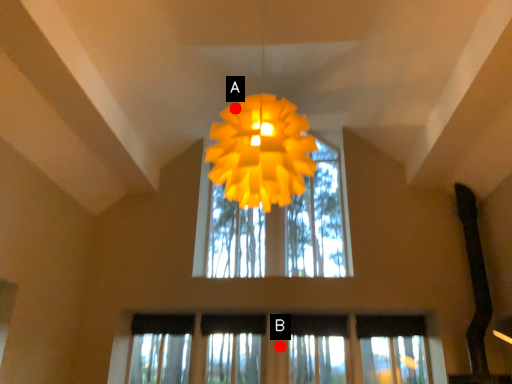
Question: Two points are circled on the image, labeled by A and B beside each circle. Which point appears closest to the camera in this image?

Choices:
 (A) A is closer
 (B) B is closer

Answer: (A)